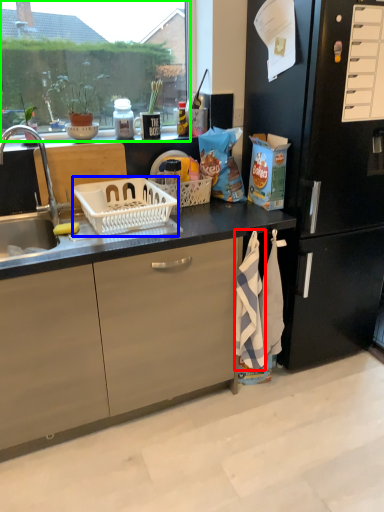
Question: Which object is the farthest from beach towel (highlighted by a red box)? Choose among these: picnic basket (highlighted by a blue box) or window screen (highlighted by a green box).

Choices:
 (A) picnic basket
 (B) window screen

Answer: (B)